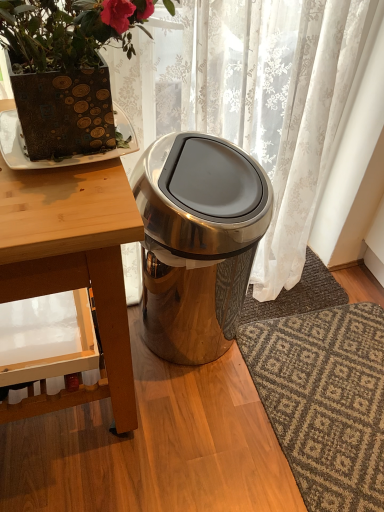
In order to click on free area in between wooden table at left and satin silver trash can at center in this screenshot , I will do `click(192, 400)`.